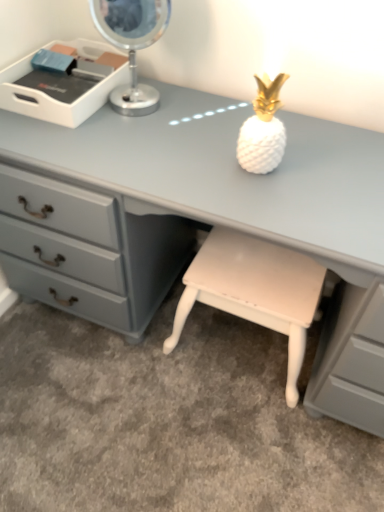
You are a GUI agent. You are given a task and a screenshot of the screen. Output one action in this format:
    pyautogui.click(x=<x>, y=<y>)
    Task: Click on the free space to the left of white glossy stool at lower center
    The width and height of the screenshot is (384, 512).
    Given the screenshot: What is the action you would take?
    pyautogui.click(x=125, y=368)